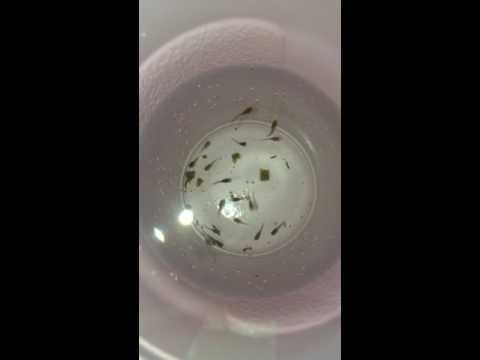
Locate an element on the screen. This screenshot has width=480, height=360. table is located at coordinates (170, 12), (232, 10), (316, 11).